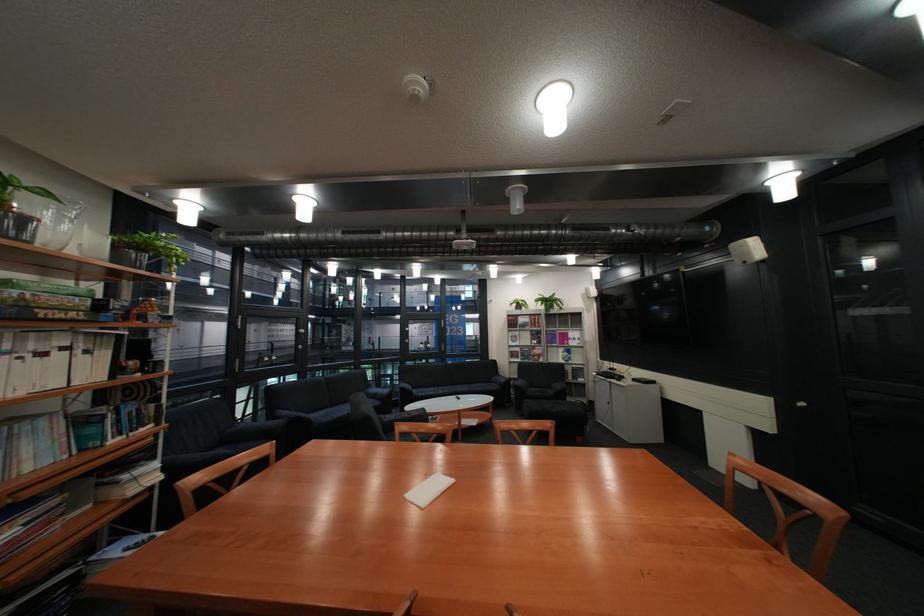
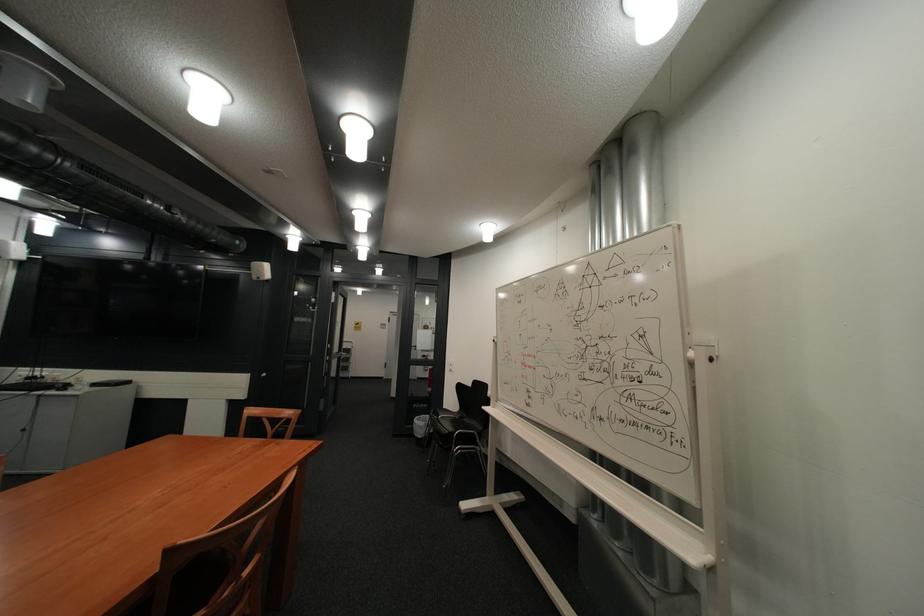
Question: The camera is either moving clockwise (left) or counter-clockwise (right) around the object. The first image is from the beginning of the video and the second image is from the end. Is the camera moving left or right when shooting the video?

Choices:
 (A) Left
 (B) Right

Answer: (A)